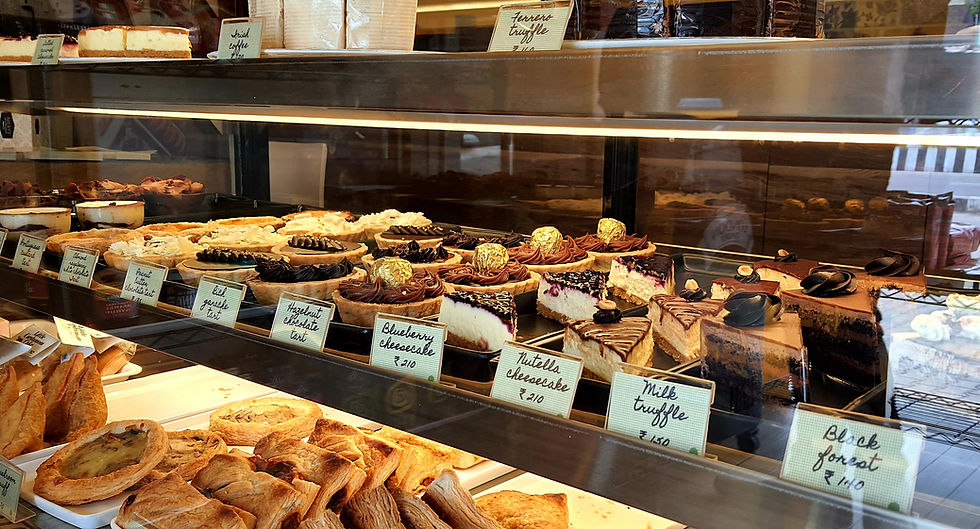
The image size is (980, 529). Find the location of `black trays`. black trays is located at coordinates (473, 360), (368, 342), (588, 386), (741, 421).